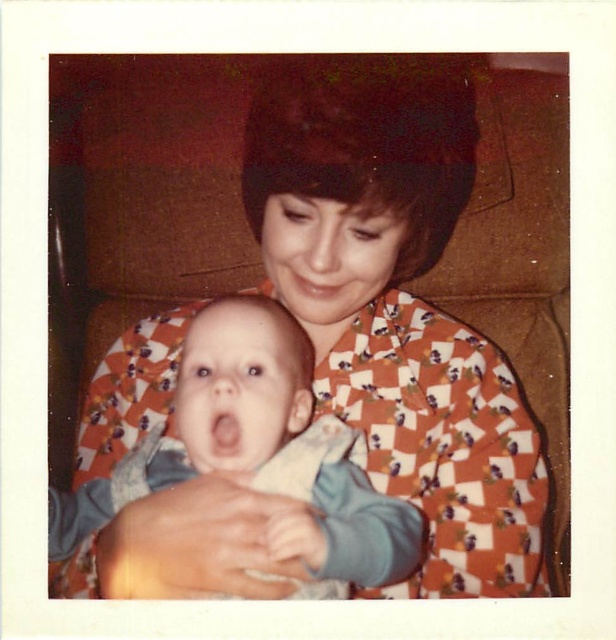
Which of these two, orange printed fabric at center or blue cotton baby at center, stands shorter?

blue cotton baby at center is shorter.

Is orange printed fabric at center bigger than blue cotton baby at center?

Yes.

Which is in front, point (428, 440) or point (249, 387)?

Positioned in front is point (249, 387).

Locate an element on the screen. orange printed fabric at center is located at coordinates (359, 268).